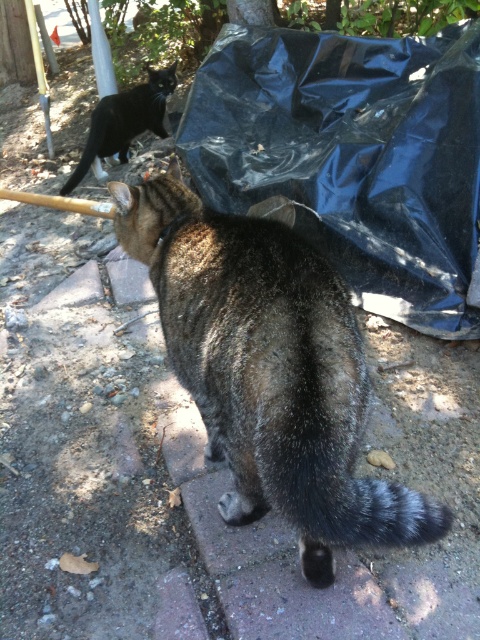
Question: Which of these objects is positioned closest to the tabby fur cat at center?

Choices:
 (A) black fur cat at upper left
 (B) black plastic bag at upper right

Answer: (B)

Question: Does tabby fur cat at center appear under black fur cat at upper left?

Choices:
 (A) yes
 (B) no

Answer: (A)

Question: Which of these objects is positioned farthest from the black fur cat at upper left?

Choices:
 (A) tabby fur cat at center
 (B) black plastic bag at upper right

Answer: (A)

Question: Is black plastic bag at upper right below black fur cat at upper left?

Choices:
 (A) yes
 (B) no

Answer: (A)

Question: Can you confirm if tabby fur cat at center is positioned above black fur cat at upper left?

Choices:
 (A) no
 (B) yes

Answer: (A)

Question: Based on their relative distances, which object is farther from the black plastic bag at upper right?

Choices:
 (A) tabby fur cat at center
 (B) black fur cat at upper left

Answer: (A)